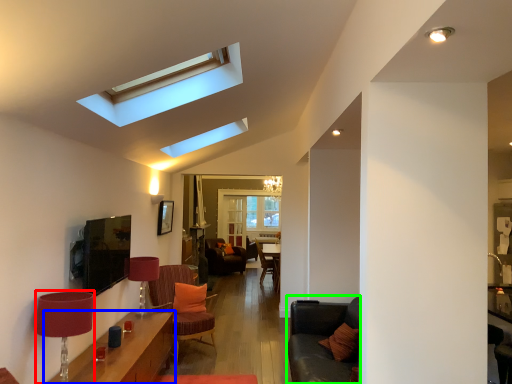
Question: Which object is the closest to the lamp (highlighted by a red box)? Choose among these: table (highlighted by a blue box) or couch (highlighted by a green box).

Choices:
 (A) table
 (B) couch

Answer: (A)